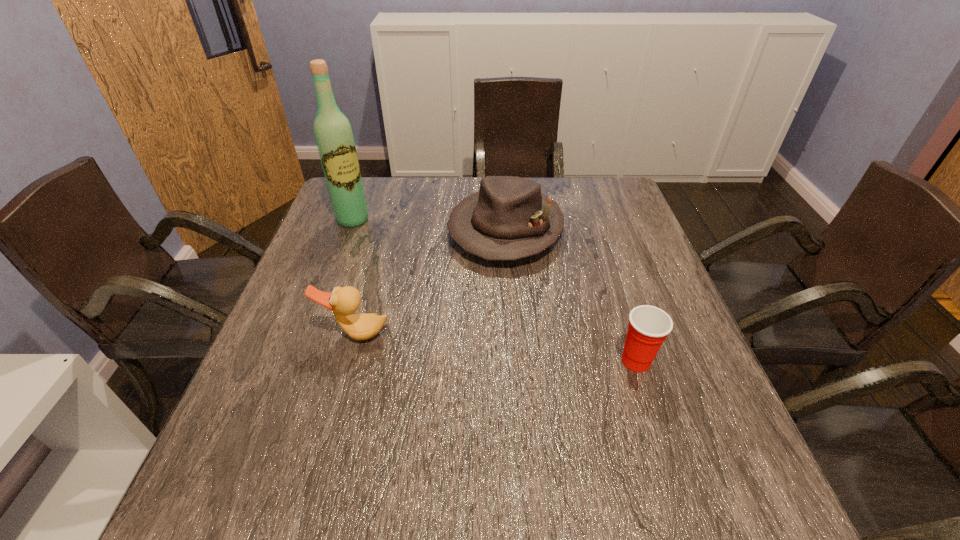
You are a GUI agent. You are given a task and a screenshot of the screen. Output one action in this format:
    pyautogui.click(x=<x>, y=<y>)
    Task: Click on the vacant region located on the front-facing side of the tallest object
    
    Given the screenshot: What is the action you would take?
    pyautogui.click(x=382, y=254)

Find the location of a particular element. vacant region located 0.370m on the front-facing side of the tallest object is located at coordinates (422, 302).

This screenshot has width=960, height=540. In order to click on free region located on the front-facing side of the tallest object in this screenshot , I will do `click(380, 252)`.

I want to click on hat positioned at the far edge, so click(x=509, y=218).

The width and height of the screenshot is (960, 540). I want to click on wine bottle at the far edge, so pos(333,134).

Where is `duck at the left edge`? duck at the left edge is located at coordinates (343, 302).

Where is `wine bottle at the left edge`? This screenshot has height=540, width=960. wine bottle at the left edge is located at coordinates (333, 134).

Image resolution: width=960 pixels, height=540 pixels. Find the location of `object that is at the right edge`. object that is at the right edge is located at coordinates coord(648,327).

Where is `object present at the far left corner`? object present at the far left corner is located at coordinates click(333, 134).

This screenshot has width=960, height=540. In the image, there is a desktop. Find the location of `blank space at the far edge`. blank space at the far edge is located at coordinates (561, 178).